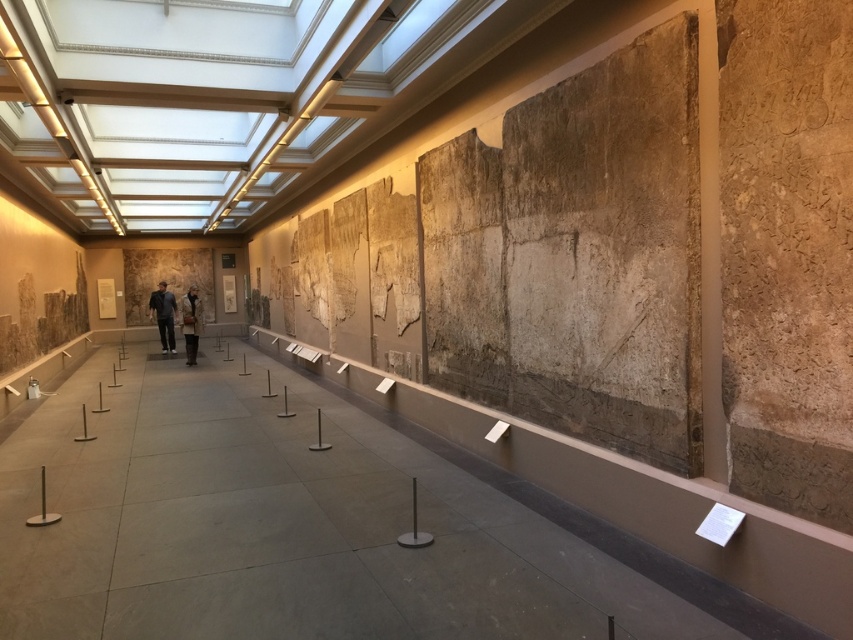
You are a security guard in the museum and need to check both the dark gray fabric jacket at center and the brown wool coat at center. Which one should you check first if you want to start from the bottom?

The dark gray fabric jacket at center should be checked first since it is located below the brown wool coat at center, making it the lower one.

Consider the image. You are standing in the museum corridor and see the point marked as point [163,316]. What object is located at that point?

The dark gray fabric jacket at center is located at point [163,316].